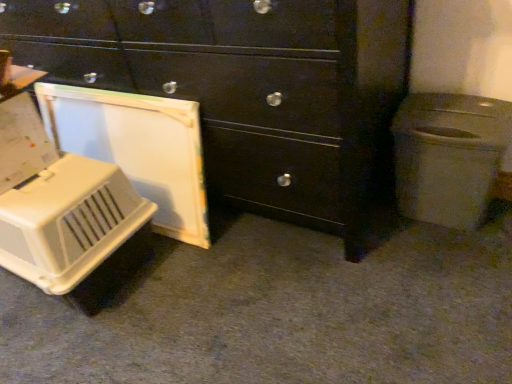
I want to click on free space between white plastic trash can at right and matte black chest of drawers at center, so click(x=418, y=242).